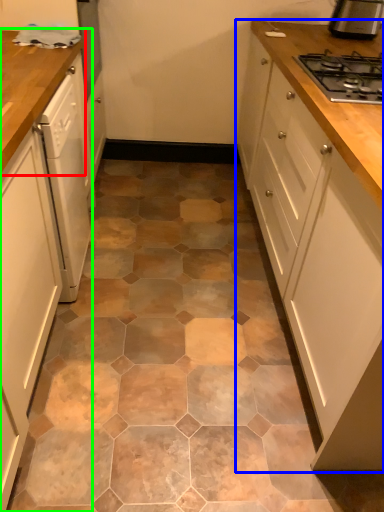
Question: Based on their relative distances, which object is nearer to countertop (highlighted by a red box)? Choose from cabinetry (highlighted by a blue box) and cabinetry (highlighted by a green box).

Choices:
 (A) cabinetry
 (B) cabinetry

Answer: (B)